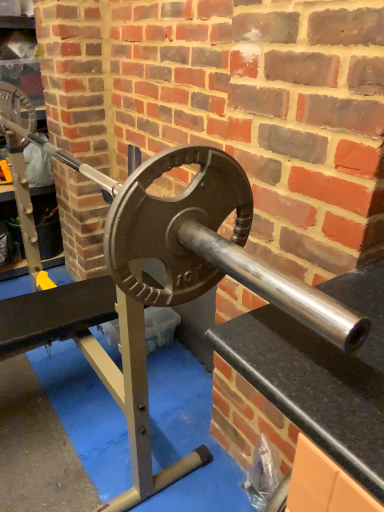
The width and height of the screenshot is (384, 512). What do you see at coordinates (192, 233) in the screenshot?
I see `shiny metallic barbell at center` at bounding box center [192, 233].

This screenshot has height=512, width=384. Find the location of `shiny metallic barbell at center`. shiny metallic barbell at center is located at coordinates (192, 233).

Find the location of a particular element. shiny metallic barbell at center is located at coordinates (192, 233).